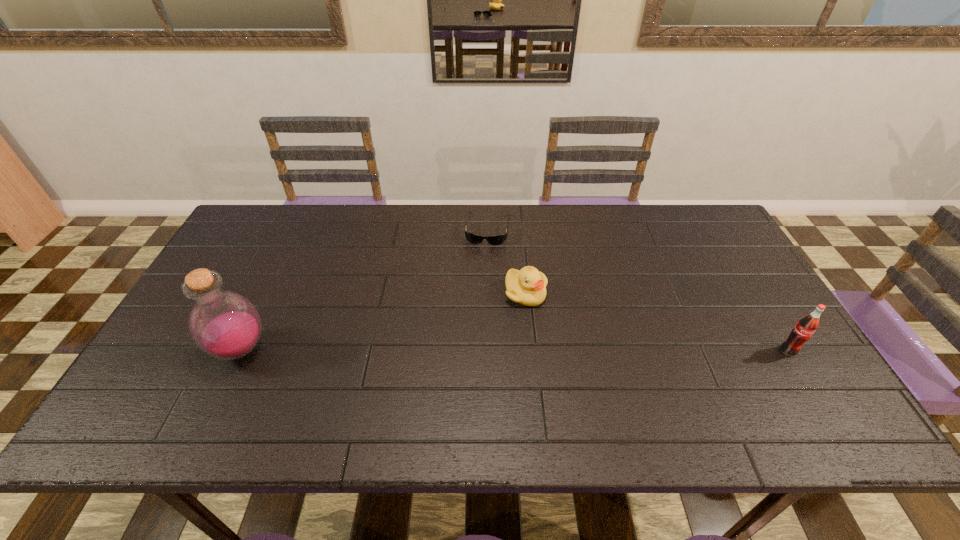
Locate an element on the screen. Image resolution: width=960 pixels, height=540 pixels. vacant space located on the front-facing side of the sunglasses is located at coordinates pyautogui.click(x=477, y=299).

Locate an element on the screen. The image size is (960, 540). free space located 0.100m on the front-facing side of the sunglasses is located at coordinates (483, 267).

This screenshot has width=960, height=540. In order to click on free space located 0.220m on the front-facing side of the sunglasses in this screenshot , I will do `click(478, 296)`.

Identify the location of free space located 0.140m on the front-facing side of the second farthest object. (544, 349).

Identify the location of vacant position located on the front-facing side of the second farthest object. Image resolution: width=960 pixels, height=540 pixels. (545, 352).

Identify the location of vacant space located on the front-facing side of the second farthest object. This screenshot has height=540, width=960. click(x=558, y=390).

Find the location of `object located at the far edge`. object located at the far edge is located at coordinates (472, 238).

Find the location of a particular element. object at the near edge is located at coordinates (225, 325).

The height and width of the screenshot is (540, 960). Identify the location of object positioned at the left edge. (225, 325).

I want to click on object positioned at the right edge, so click(807, 325).